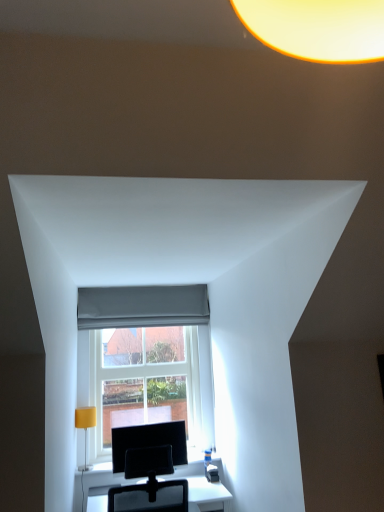
Question: Considering the relative sizes of yellow fabric lampshade at left and black glossy monitor at center in the image provided, is yellow fabric lampshade at left wider than black glossy monitor at center?

Choices:
 (A) yes
 (B) no

Answer: (A)

Question: From the image's perspective, does yellow fabric lampshade at left appear lower than black glossy monitor at center?

Choices:
 (A) no
 (B) yes

Answer: (A)

Question: Considering the relative sizes of yellow fabric lampshade at left and black glossy monitor at center in the image provided, is yellow fabric lampshade at left bigger than black glossy monitor at center?

Choices:
 (A) no
 (B) yes

Answer: (A)

Question: Is yellow fabric lampshade at left at the left side of black glossy monitor at center?

Choices:
 (A) no
 (B) yes

Answer: (B)

Question: Is yellow fabric lampshade at left positioned far away from black glossy monitor at center?

Choices:
 (A) yes
 (B) no

Answer: (B)

Question: Is yellow fabric lampshade at left closer to the viewer compared to black glossy monitor at center?

Choices:
 (A) yes
 (B) no

Answer: (B)

Question: Considering the relative sizes of gray fabric curtain at center and clear glass window at center in the image provided, is gray fabric curtain at center shorter than clear glass window at center?

Choices:
 (A) no
 (B) yes

Answer: (B)

Question: Is clear glass window at center completely or partially inside gray fabric curtain at center?

Choices:
 (A) no
 (B) yes

Answer: (A)

Question: Is gray fabric curtain at center not near clear glass window at center?

Choices:
 (A) no
 (B) yes

Answer: (A)

Question: Can you confirm if gray fabric curtain at center is positioned to the right of clear glass window at center?

Choices:
 (A) no
 (B) yes

Answer: (A)

Question: Is the depth of gray fabric curtain at center greater than that of clear glass window at center?

Choices:
 (A) no
 (B) yes

Answer: (B)

Question: Considering the relative positions of gray fabric curtain at center and clear glass window at center in the image provided, is gray fabric curtain at center in front of clear glass window at center?

Choices:
 (A) no
 (B) yes

Answer: (A)

Question: Does clear glass window at center turn towards gray fabric curtain at center?

Choices:
 (A) no
 (B) yes

Answer: (A)